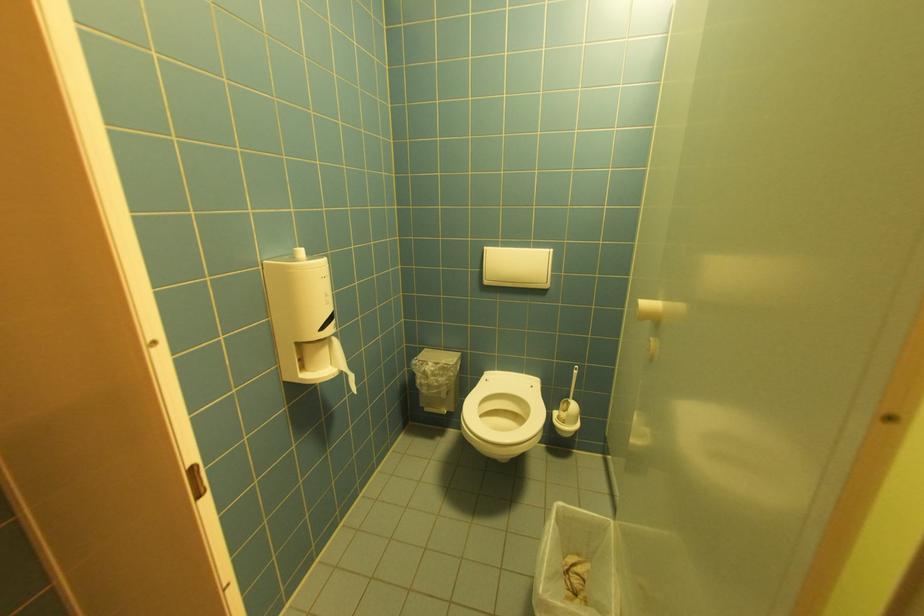
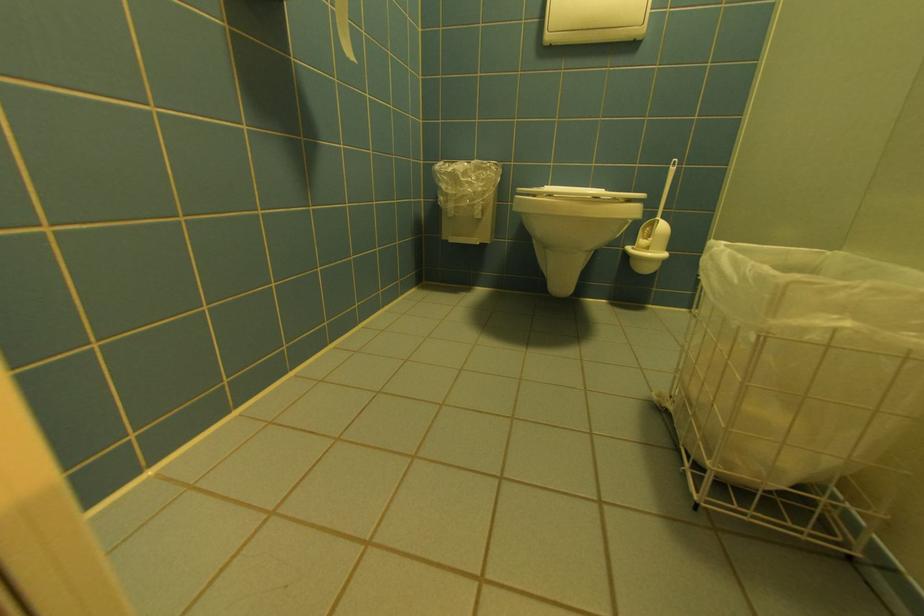
Question: The first image is from the beginning of the video and the second image is from the end. How did the camera likely rotate when shooting the video?

Choices:
 (A) Left
 (B) Right
 (C) Up
 (D) Down

Answer: (D)